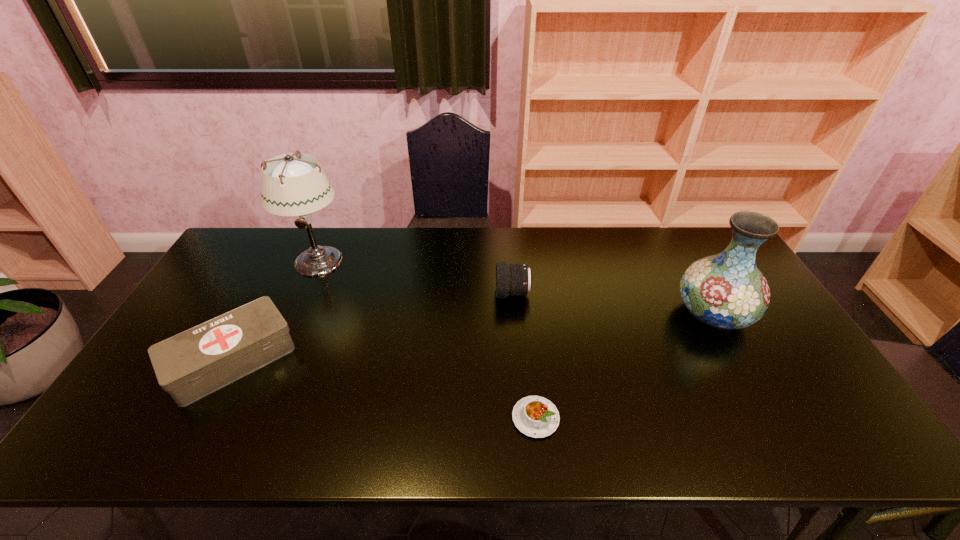
Identify the location of vacant point located 0.060m at the front element of the telephoto lens. (476, 293).

The width and height of the screenshot is (960, 540). In order to click on free region located on the right of the second shortest object in this screenshot , I will do `click(420, 360)`.

I want to click on free space located 0.100m on the left of the shortest object, so click(x=469, y=418).

The height and width of the screenshot is (540, 960). I want to click on object located in the far edge section of the desktop, so click(x=291, y=186).

Identify the location of object present at the near edge. This screenshot has width=960, height=540. (535, 416).

Find the location of a particular element. object present at the left edge is located at coordinates (192, 364).

You are a GUI agent. You are given a task and a screenshot of the screen. Output one action in this format:
    pyautogui.click(x=<x>, y=<y>)
    Task: Click on the object located at the right edge
    
    Given the screenshot: What is the action you would take?
    pyautogui.click(x=724, y=291)

The height and width of the screenshot is (540, 960). I want to click on vacant space at the far edge, so click(541, 237).

The image size is (960, 540). What are the coordinates of `free space at the near edge` in the screenshot? It's located at (264, 424).

This screenshot has width=960, height=540. In the image, there is a desktop. Identify the location of vacant space at the right edge. (761, 320).